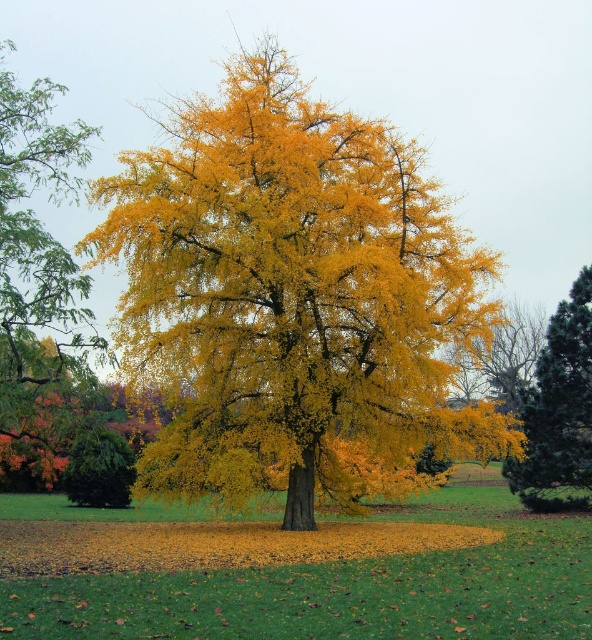
Question: Which object appears farthest from the camera in this image?

Choices:
 (A) shiny dark green pine tree at right
 (B) yellow leafy tree at center
 (C) yellow matte tree at center

Answer: (A)

Question: Is yellow leafy tree at center smaller than yellow matte tree at center?

Choices:
 (A) yes
 (B) no

Answer: (B)

Question: Which point is closer to the camera taking this photo?

Choices:
 (A) click(548, 461)
 (B) click(178, 342)

Answer: (B)

Question: Considering the relative positions of yellow leafy tree at center and yellow matte tree at center in the image provided, where is yellow leafy tree at center located with respect to yellow matte tree at center?

Choices:
 (A) right
 (B) left

Answer: (B)

Question: Which object appears closest to the camera in this image?

Choices:
 (A) yellow leafy tree at center
 (B) yellow matte tree at center

Answer: (A)

Question: Is yellow leafy tree at center above yellow matte tree at center?

Choices:
 (A) yes
 (B) no

Answer: (A)